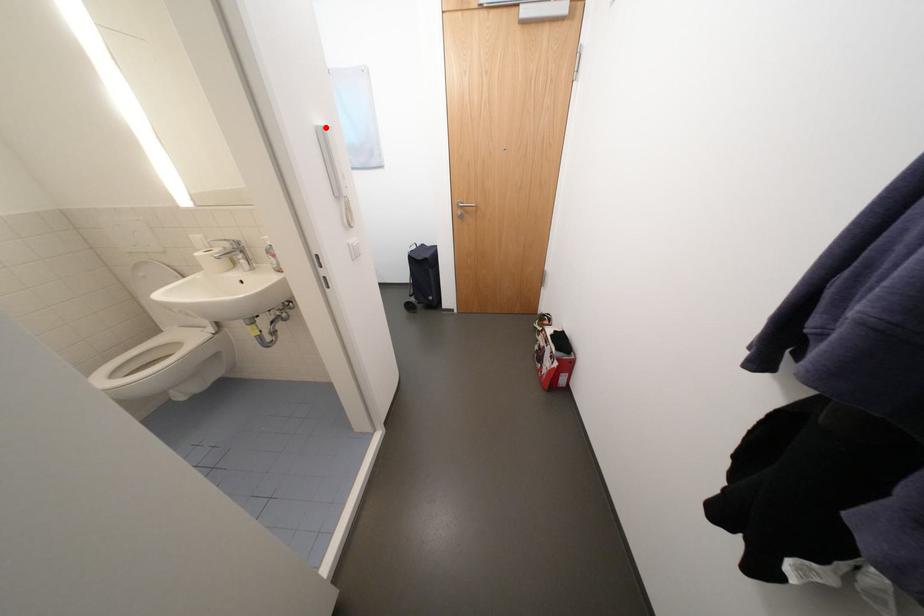
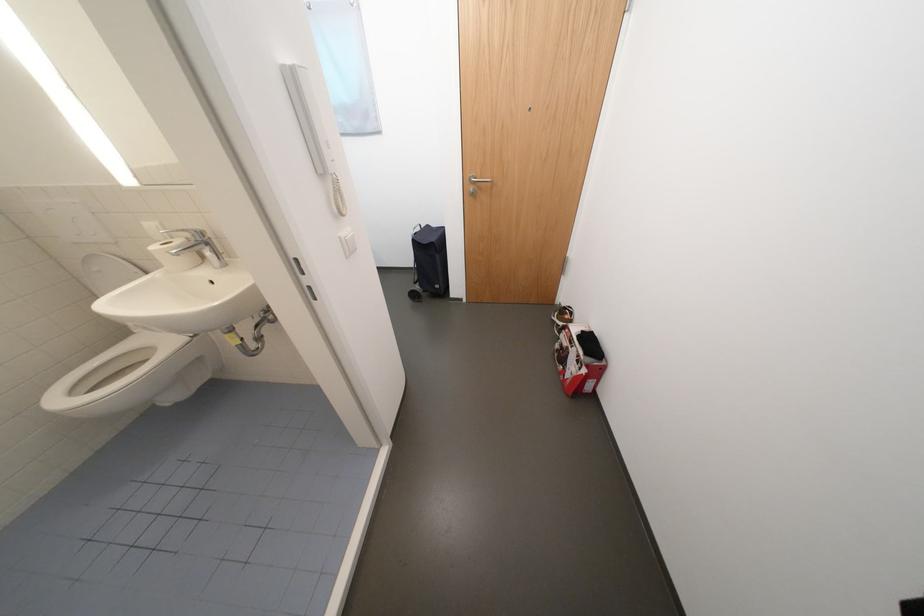
Where in the second image is the point corresponding to the highlighted location from the first image?

(292, 66)